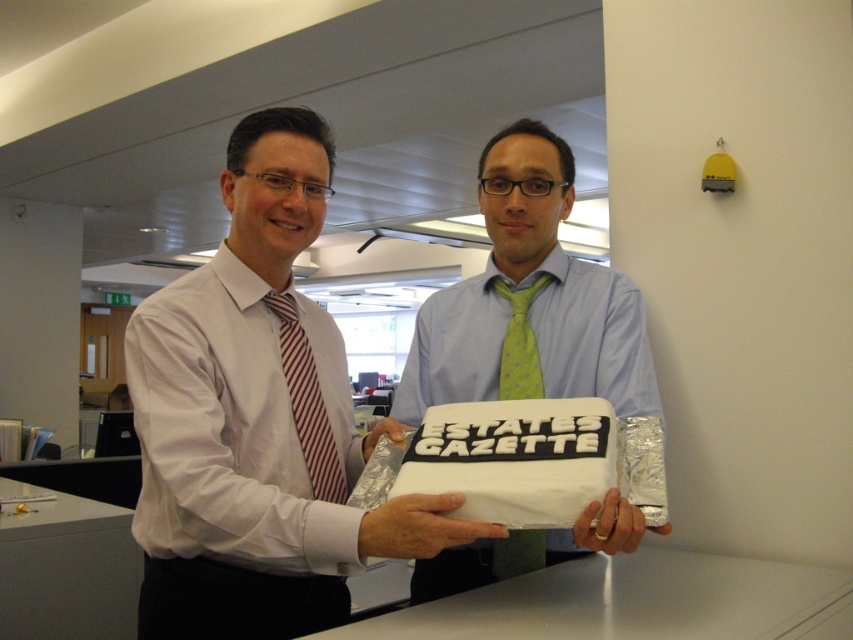
Is white matte cake at center behind green dotted tie at center?

That is False.

Is white matte cake at center smaller than green dotted tie at center?

No, white matte cake at center is not smaller than green dotted tie at center.

Identify the location of white matte cake at center. Image resolution: width=853 pixels, height=640 pixels. (280, 429).

You are a GUI agent. You are given a task and a screenshot of the screen. Output one action in this format:
    pyautogui.click(x=<x>, y=<y>)
    Task: Click on the white matte cake at center
    
    Given the screenshot: What is the action you would take?
    pyautogui.click(x=280, y=429)

Is white matte cake at center positioned at the back of red striped tie at left?

No.

What do you see at coordinates (280, 429) in the screenshot?
I see `white matte cake at center` at bounding box center [280, 429].

Where is `white matte cake at center`? The width and height of the screenshot is (853, 640). white matte cake at center is located at coordinates (280, 429).

Does green dotted tie at center have a larger size compared to red striped tie at left?

Correct, green dotted tie at center is larger in size than red striped tie at left.

Identify the location of green dotted tie at center. (529, 301).